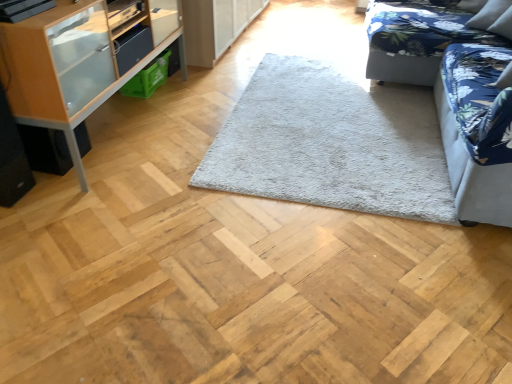
Question: Does velvet floral studio couch at right, the first studio couch viewed from the front, have a lesser width compared to blue floral fabric couch at upper right, the 2th studio couch positioned from the front?

Choices:
 (A) yes
 (B) no

Answer: (A)

Question: From the image's perspective, would you say velvet floral studio couch at right, the first studio couch viewed from the front, is positioned over blue floral fabric couch at upper right, the 2th studio couch positioned from the front?

Choices:
 (A) yes
 (B) no

Answer: (B)

Question: Is velvet floral studio couch at right, acting as the second studio couch starting from the back, behind blue floral fabric couch at upper right, the first studio couch in the back-to-front sequence?

Choices:
 (A) no
 (B) yes

Answer: (A)

Question: Does velvet floral studio couch at right, acting as the second studio couch starting from the back, have a greater width compared to blue floral fabric couch at upper right, the 2th studio couch positioned from the front?

Choices:
 (A) no
 (B) yes

Answer: (A)

Question: From a real-world perspective, does velvet floral studio couch at right, the first studio couch viewed from the front, stand above blue floral fabric couch at upper right, the 2th studio couch positioned from the front?

Choices:
 (A) yes
 (B) no

Answer: (A)

Question: Does velvet floral studio couch at right, acting as the second studio couch starting from the back, appear on the right side of blue floral fabric couch at upper right, the first studio couch in the back-to-front sequence?

Choices:
 (A) no
 (B) yes

Answer: (A)

Question: Would you say gray fluffy rug at center contains velvet floral studio couch at right, acting as the second studio couch starting from the back?

Choices:
 (A) yes
 (B) no

Answer: (B)

Question: Does gray fluffy rug at center come behind velvet floral studio couch at right, acting as the second studio couch starting from the back?

Choices:
 (A) no
 (B) yes

Answer: (B)

Question: Considering the relative sizes of gray fluffy rug at center and velvet floral studio couch at right, the first studio couch viewed from the front, in the image provided, is gray fluffy rug at center thinner than velvet floral studio couch at right, the first studio couch viewed from the front,?

Choices:
 (A) no
 (B) yes

Answer: (A)

Question: Does gray fluffy rug at center appear on the right side of velvet floral studio couch at right, acting as the second studio couch starting from the back?

Choices:
 (A) yes
 (B) no

Answer: (B)

Question: From the image's perspective, would you say gray fluffy rug at center is positioned over velvet floral studio couch at right, the first studio couch viewed from the front?

Choices:
 (A) yes
 (B) no

Answer: (B)

Question: Is gray fluffy rug at center placed right next to velvet floral studio couch at right, acting as the second studio couch starting from the back?

Choices:
 (A) no
 (B) yes

Answer: (A)

Question: From the image's perspective, would you say gray fluffy rug at center is shown under blue floral fabric couch at upper right, the first studio couch in the back-to-front sequence?

Choices:
 (A) yes
 (B) no

Answer: (A)